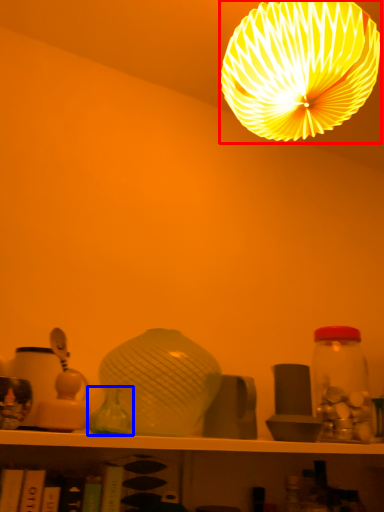
Question: Which object is further to the camera taking this photo, lamp (highlighted by a red box) or glass vase (highlighted by a blue box)?

Choices:
 (A) lamp
 (B) glass vase

Answer: (B)